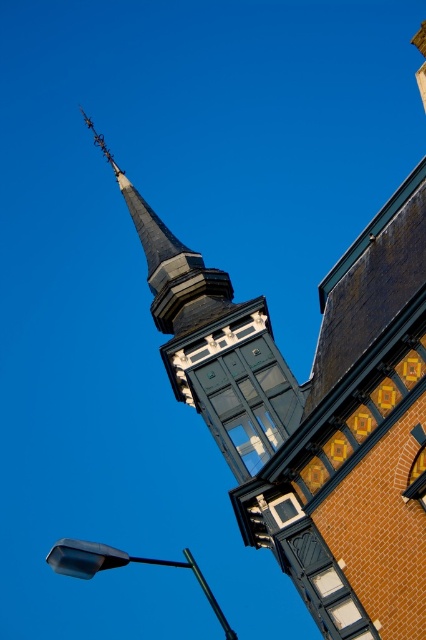
You are standing at the base of the building and want to take a photo of the dark gray slate steeple at upper left. If your camera can focus on objects up to 50 meters away, will you be able to capture a clear image of the steeple?

The dark gray slate steeple at upper left is 52.52 meters away from the camera, which exceeds the camera maximum focus range of 50 meters. Therefore, the camera cannot focus on the steeple clearly.

What is the spatial relationship between the dark gray slate steeple at upper left and the matte black streetlight at lower left in the image?

The dark gray slate steeple at upper left is positioned to the left of the matte black streetlight at lower left.

You are an architect analyzing the building in the image. You need to determine the exact position of the dark gray slate steeple at upper left. What are its coordinates?

The dark gray slate steeple at upper left is located at coordinates point (213, 342).